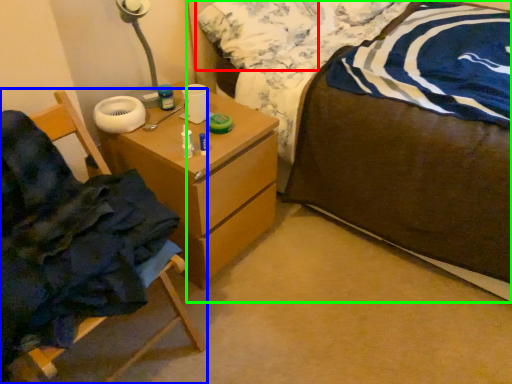
Question: Which object is positioned closest to pillow (highlighted by a red box)? Select from chair (highlighted by a blue box) and bed (highlighted by a green box).

Choices:
 (A) chair
 (B) bed

Answer: (B)